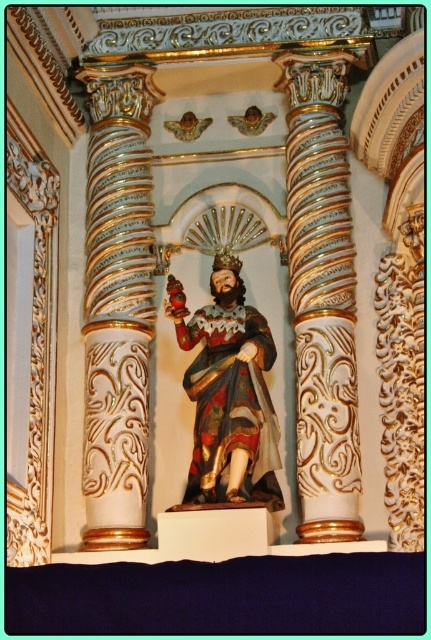
Consider the image. You are an interior designer assessing the space for a new lighting fixture. You notice the white glossy column at center and the wooden statue at center. Which object is taller and would require a higher ceiling clearance?

The white glossy column at center is much taller than the wooden statue at center, so it would require higher ceiling clearance.

You are standing in the center of the room facing the statue. There is a point marked at coordinates (118, 305). Which object is this point located on?

The point at coordinates (118, 305) is located on the white glossy column at left.